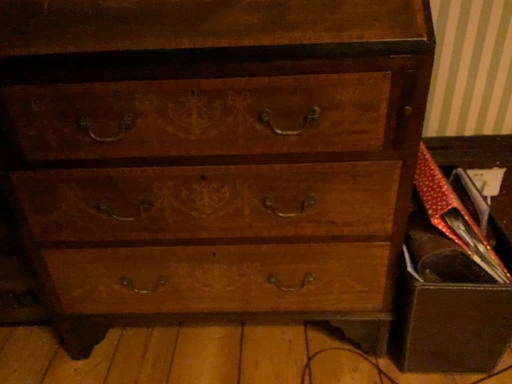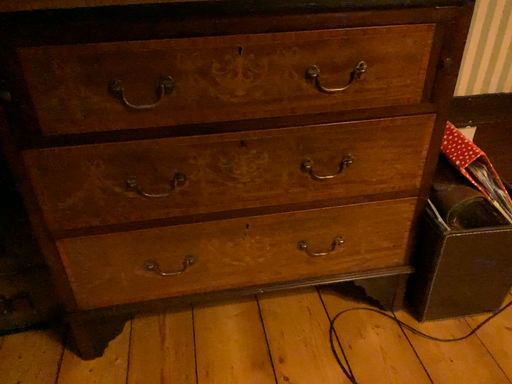
Question: How did the camera likely rotate when shooting the video?

Choices:
 (A) rotated left
 (B) rotated right

Answer: (B)